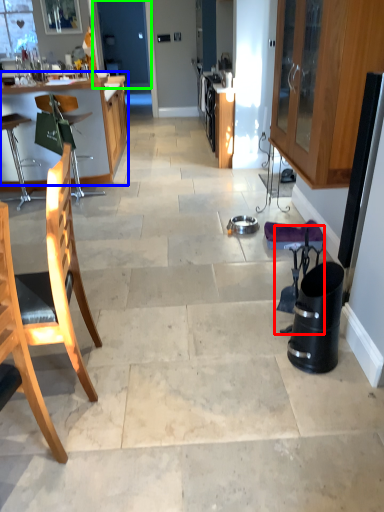
Question: Estimate the real-world distances between objects in this image. Which object is closer to swivel chair (highlighted by a red box), table (highlighted by a blue box) or screen door (highlighted by a green box)?

Choices:
 (A) table
 (B) screen door

Answer: (A)